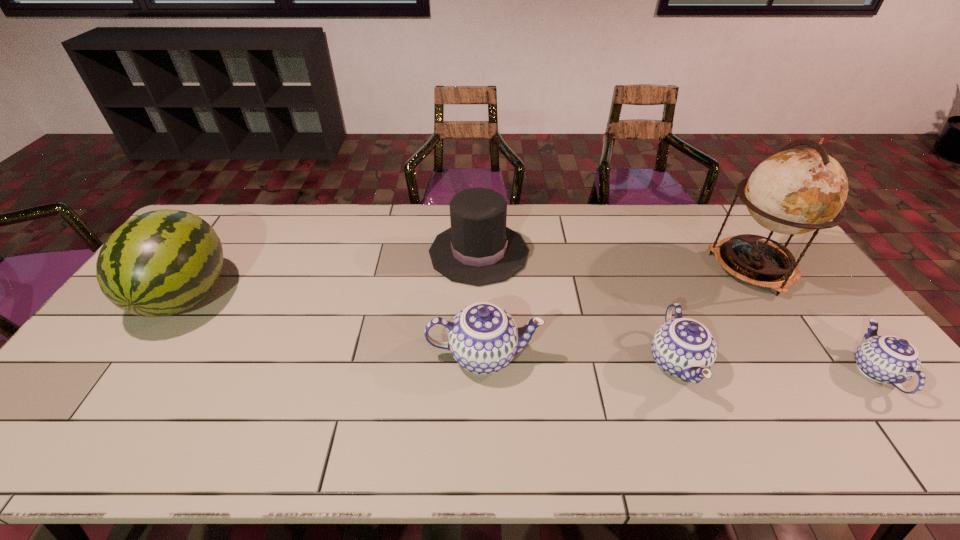
This screenshot has height=540, width=960. In order to click on free space that satisfies the following two spatial constraints: 1. on the front of the dress hat with the decoration; 2. at the spout of the shortest object in this screenshot , I will do `click(478, 370)`.

I want to click on free space that satisfies the following two spatial constraints: 1. at the spout of the leftmost chinaware; 2. at the spout of the shortest chinaware, so click(484, 370).

This screenshot has width=960, height=540. In order to click on vacant space that satisfies the following two spatial constraints: 1. on the front of the dress hat with the decoration; 2. at the stem end of the second tallest object in this screenshot , I will do `click(479, 295)`.